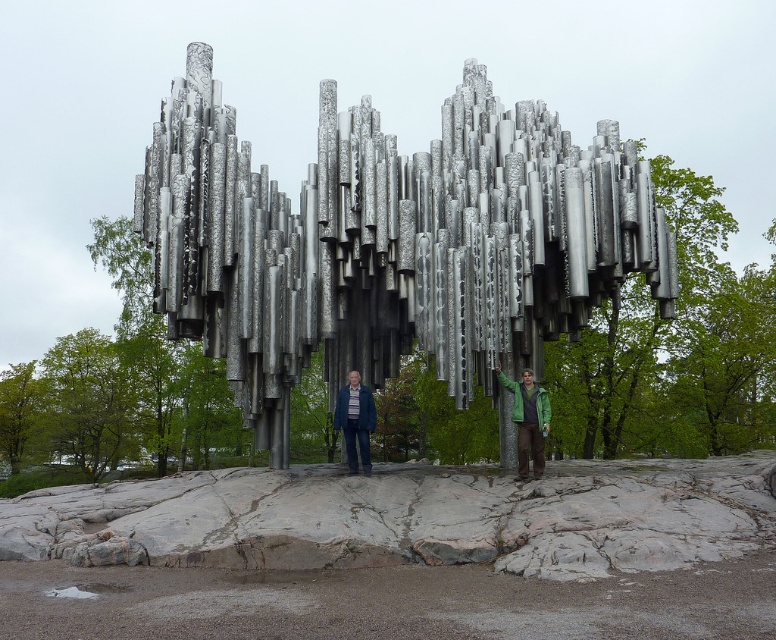
You are an artist planning to paint the sculpture. You notice two people in the scene wearing jackets. Which jacket, the green matte jacket at center or the matte blue jacket at center, would be harder to paint because it has a simpler shape?

The green matte jacket at center is thinner than the matte blue jacket at center, so the green matte jacket at center would be harder to paint because it has a simpler shape.

You are an art critic observing the sculpture and the two people in front of it. Which person wearing a green matte jacket at center is positioned to the right of the person wearing the matte blue jacket at center?

The green matte jacket at center is positioned to the right of the matte blue jacket at center, so the person wearing the green matte jacket at center is to the right of the person in the matte blue jacket at center.

You are an artist planning to photograph the sculpture and the two people in front of it. You want to ensure that the silver metallic wind chimes at center and the matte blue jacket at center are both clearly visible in the frame. Given their sizes, which object should you focus on to ensure both are in focus?

The silver metallic wind chimes at center are wider than the matte blue jacket at center, so focusing on the larger object will help ensure both are in focus.